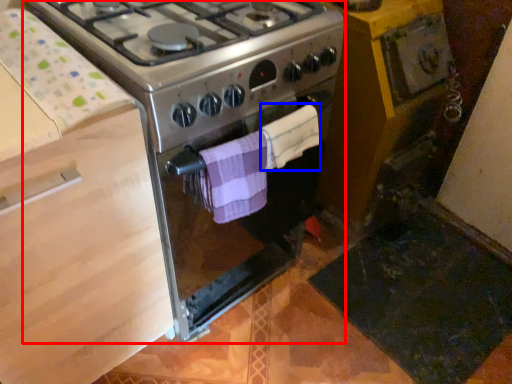
Question: Among these objects, which one is farthest to the camera, gas stove (highlighted by a red box) or towel/napkin (highlighted by a blue box)?

Choices:
 (A) gas stove
 (B) towel/napkin

Answer: (B)